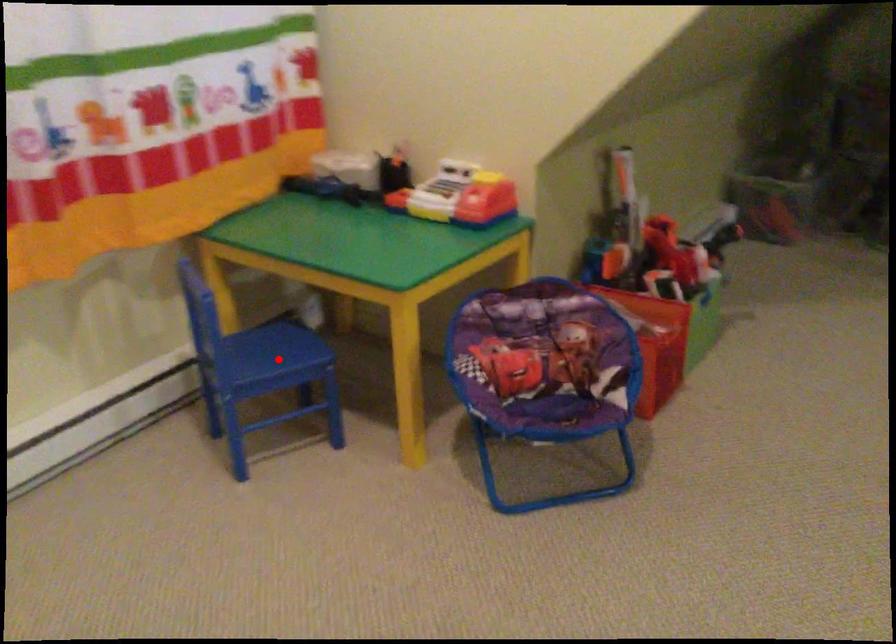
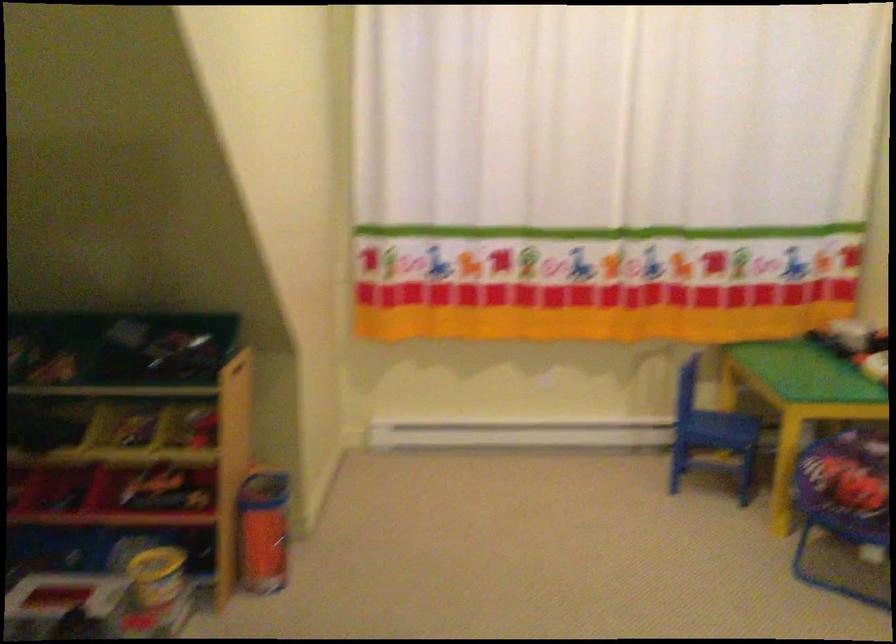
Question: A red point is marked in image1. In image2, is the corresponding 3D point closer to the camera or farther? Reply with the corresponding letter.

Choices:
 (A) The corresponding 3D point is closer.
 (B) The corresponding 3D point is farther.

Answer: (B)